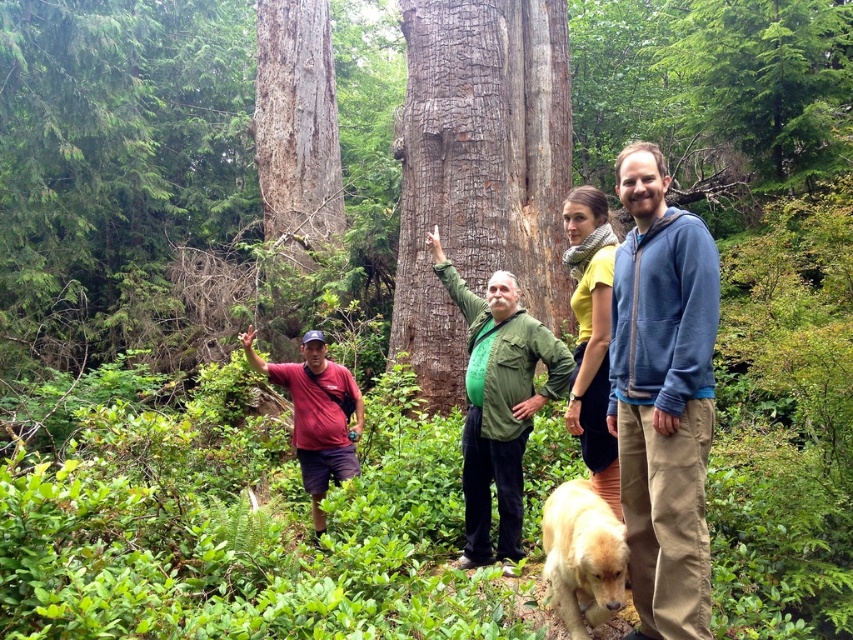
Can you confirm if smooth brown bark at center is bigger than matte red t-shirt at lower left?

Incorrect, smooth brown bark at center is not larger than matte red t-shirt at lower left.

Is point (436, 77) positioned in front of point (358, 403)?

No, (436, 77) is behind (358, 403).

Image resolution: width=853 pixels, height=640 pixels. What are the coordinates of `smooth brown bark at center` in the screenshot? It's located at (479, 170).

Can you confirm if smooth brown bark at center is positioned to the left of yellow matte scarf at upper center?

Correct, you'll find smooth brown bark at center to the left of yellow matte scarf at upper center.

The image size is (853, 640). I want to click on smooth brown bark at center, so click(479, 170).

Find the location of `smooth brown bark at center`. smooth brown bark at center is located at coordinates (479, 170).

Is yellow matte scarf at upper center thinner than golden fur dog at lower center?

Yes.

Who is more forward, (608, 236) or (566, 566)?

Point (566, 566) is more forward.

Where is `yellow matte scarf at upper center`? The height and width of the screenshot is (640, 853). yellow matte scarf at upper center is located at coordinates (x=590, y=336).